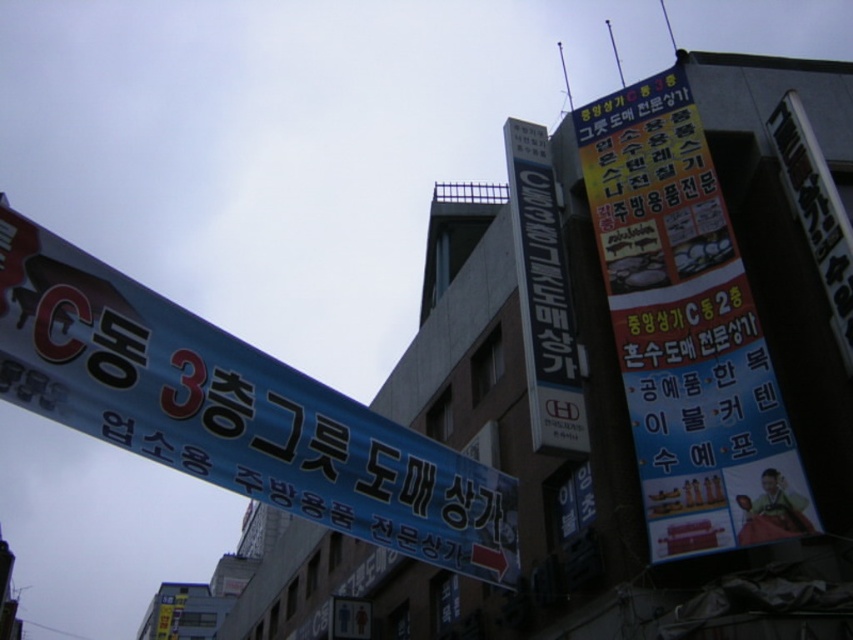
Question: Estimate the real-world distances between objects in this image. Which object is closer to the blue metallic sign at center?

Choices:
 (A) blue plastic banner at upper left
 (B) yellow paper sign at upper right

Answer: (B)

Question: Where is yellow paper sign at upper right located in relation to blue metallic sign at center in the image?

Choices:
 (A) above
 (B) below

Answer: (A)

Question: Which point is farther to the camera?

Choices:
 (A) (491, 531)
 (B) (715, 316)

Answer: (B)

Question: Is blue plastic banner at upper left closer to the viewer compared to blue metallic sign at center?

Choices:
 (A) yes
 (B) no

Answer: (A)

Question: Can you confirm if yellow paper sign at upper right is positioned below blue metallic sign at center?

Choices:
 (A) yes
 (B) no

Answer: (B)

Question: Which object appears farthest from the camera in this image?

Choices:
 (A) blue plastic banner at upper left
 (B) blue metallic sign at center

Answer: (B)